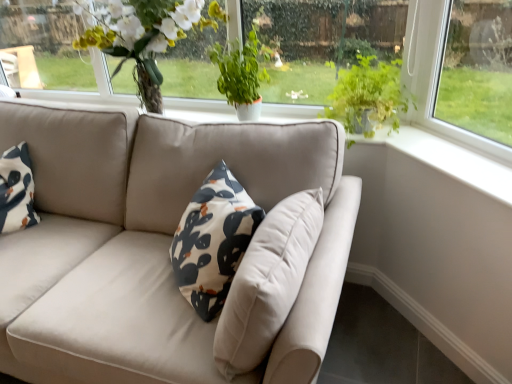
Question: From the image's perspective, is green leafy plant at upper center over green leafy plant at center, placed as the 2th houseplant when sorted from right to left?

Choices:
 (A) no
 (B) yes

Answer: (B)

Question: Is green leafy plant at upper center outside of green leafy plant at center, placed as the 2th houseplant when sorted from right to left?

Choices:
 (A) yes
 (B) no

Answer: (A)

Question: Is green leafy plant at upper center surrounding green leafy plant at center, arranged as the 1th houseplant when viewed from the left?

Choices:
 (A) yes
 (B) no

Answer: (B)

Question: Is green leafy plant at upper center shorter than green leafy plant at center, placed as the 2th houseplant when sorted from right to left?

Choices:
 (A) no
 (B) yes

Answer: (A)

Question: Considering the relative positions of green leafy plant at upper center and green leafy plant at center, arranged as the 1th houseplant when viewed from the left, in the image provided, is green leafy plant at upper center to the left of green leafy plant at center, arranged as the 1th houseplant when viewed from the left, from the viewer's perspective?

Choices:
 (A) no
 (B) yes

Answer: (A)

Question: Considering the positions of green leafy plant at center, placed as the 2th houseplant when sorted from right to left, and matte white vase at upper center in the image, is green leafy plant at center, placed as the 2th houseplant when sorted from right to left, wider or thinner than matte white vase at upper center?

Choices:
 (A) wide
 (B) thin

Answer: (B)

Question: From a real-world perspective, is green leafy plant at center, arranged as the 1th houseplant when viewed from the left, positioned above or below matte white vase at upper center?

Choices:
 (A) above
 (B) below

Answer: (B)

Question: Would you say green leafy plant at center, placed as the 2th houseplant when sorted from right to left, is to the left or to the right of matte white vase at upper center in the picture?

Choices:
 (A) left
 (B) right

Answer: (B)

Question: Would you say green leafy plant at center, placed as the 2th houseplant when sorted from right to left, is inside or outside matte white vase at upper center?

Choices:
 (A) inside
 (B) outside

Answer: (B)

Question: Based on their sizes in the image, would you say matte white vase at upper center is bigger or smaller than green leafy plant at upper right, marked as the first houseplant in a right-to-left arrangement?

Choices:
 (A) big
 (B) small

Answer: (A)

Question: Considering the relative positions of matte white vase at upper center and green leafy plant at upper right, marked as the first houseplant in a right-to-left arrangement, in the image provided, is matte white vase at upper center to the left or to the right of green leafy plant at upper right, marked as the first houseplant in a right-to-left arrangement,?

Choices:
 (A) left
 (B) right

Answer: (A)

Question: In the image, is matte white vase at upper center positioned in front of or behind green leafy plant at upper right, which appears as the second houseplant when viewed from the left?

Choices:
 (A) front
 (B) behind

Answer: (B)

Question: Is matte white vase at upper center wider or thinner than green leafy plant at upper right, marked as the first houseplant in a right-to-left arrangement?

Choices:
 (A) wide
 (B) thin

Answer: (A)

Question: Is green leafy plant at center, arranged as the 1th houseplant when viewed from the left, in front of or behind green leafy plant at upper right, marked as the first houseplant in a right-to-left arrangement, in the image?

Choices:
 (A) front
 (B) behind

Answer: (B)

Question: From a real-world perspective, is green leafy plant at center, arranged as the 1th houseplant when viewed from the left, positioned above or below green leafy plant at upper right, marked as the first houseplant in a right-to-left arrangement?

Choices:
 (A) below
 (B) above

Answer: (B)